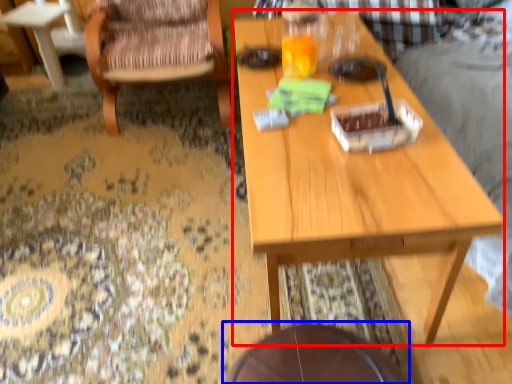
Question: Which of the following is the closest to the observer, table (highlighted by a red box) or round table (highlighted by a blue box)?

Choices:
 (A) table
 (B) round table

Answer: (A)